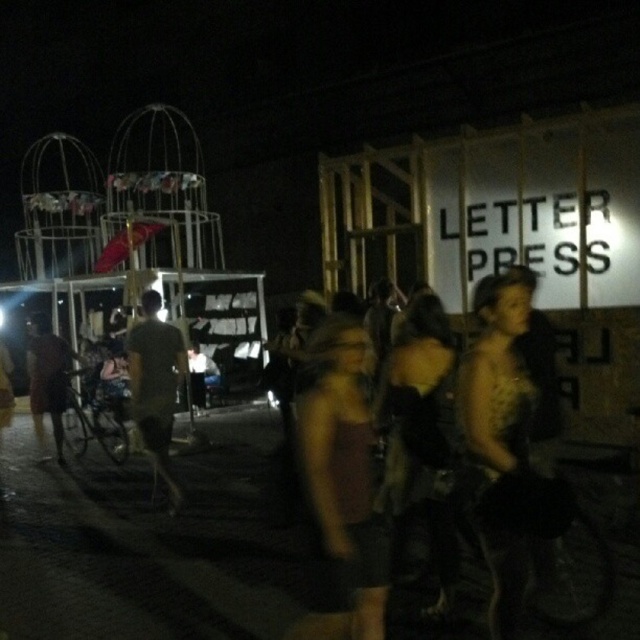
Can you confirm if matte brown dress at center is positioned below gray matte t-shirt at center?

No, matte brown dress at center is not below gray matte t-shirt at center.

Does matte brown dress at center have a greater width compared to gray matte t-shirt at center?

Incorrect, matte brown dress at center's width does not surpass gray matte t-shirt at center's.

The image size is (640, 640). What are the coordinates of `matte brown dress at center` in the screenshot? It's located at (339, 486).

Is gray matte t-shirt at center smaller than brown fabric dress at left?

Yes, gray matte t-shirt at center is smaller than brown fabric dress at left.

Is point (170, 413) less distant than point (64, 346)?

Yes, it is.

Who is more distant from viewer, (132, 396) or (72, 358)?

The point (72, 358) is more distant.

Find the location of a particular element. The height and width of the screenshot is (640, 640). gray matte t-shirt at center is located at coordinates (156, 387).

Does matte black dress at center come in front of gray matte t-shirt at center?

That is True.

Between matte black dress at center and gray matte t-shirt at center, which one has more height?

With more height is gray matte t-shirt at center.

I want to click on matte black dress at center, so click(506, 445).